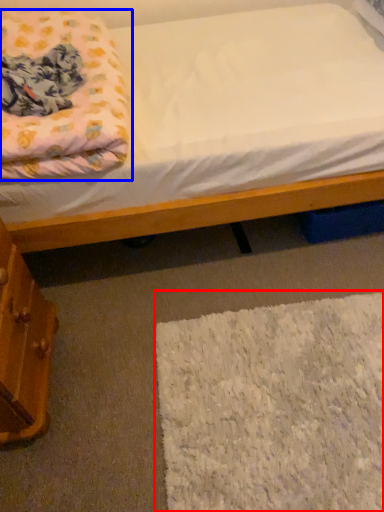
Question: Which of the following is the closest to the observer, mat (highlighted by a red box) or blanket (highlighted by a blue box)?

Choices:
 (A) mat
 (B) blanket

Answer: (B)